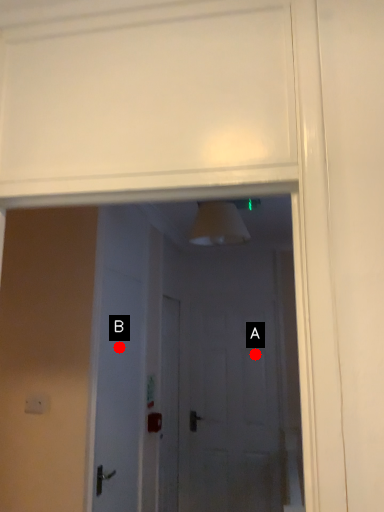
Question: Two points are circled on the image, labeled by A and B beside each circle. Which of the following is the farthest from the observer?

Choices:
 (A) A is further
 (B) B is further

Answer: (A)